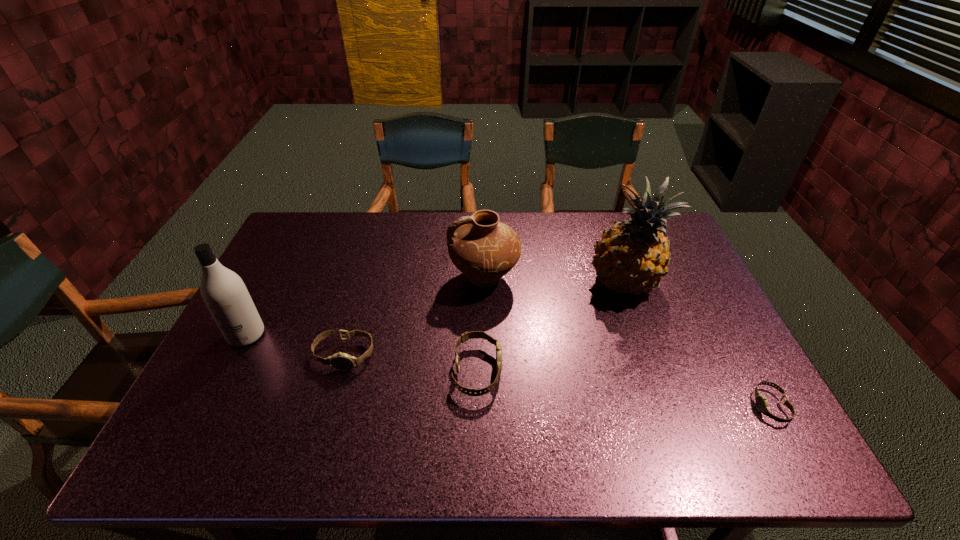
Locate an element on the screen. Image resolution: width=960 pixels, height=540 pixels. object that is the fourth closest to the pineapple is located at coordinates (341, 361).

Choose which watch is the nearest neighbor to the shortest object. Please provide its 2D coordinates. Your answer should be formatted as a tuple, i.e. [(x, y)], where the tuple contains the x and y coordinates of a point satisfying the conditions above.

[(465, 336)]

I want to click on watch that is the closest to the second watch from left to right, so click(341, 361).